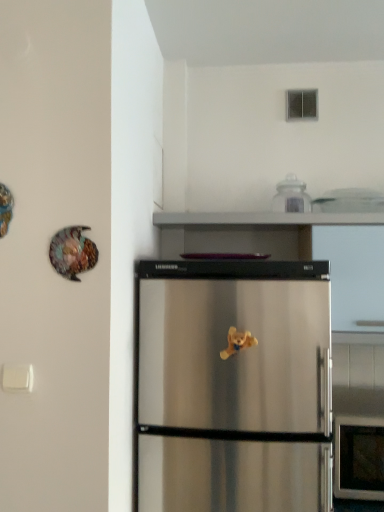
Question: Can you confirm if clear glass jar at upper center is positioned to the right of shiny metallic plate at upper left?

Choices:
 (A) yes
 (B) no

Answer: (A)

Question: Considering the relative sizes of clear glass jar at upper center and shiny metallic plate at upper left in the image provided, is clear glass jar at upper center smaller than shiny metallic plate at upper left?

Choices:
 (A) yes
 (B) no

Answer: (B)

Question: From a real-world perspective, is clear glass jar at upper center below shiny metallic plate at upper left?

Choices:
 (A) yes
 (B) no

Answer: (B)

Question: Does clear glass jar at upper center have a greater height compared to shiny metallic plate at upper left?

Choices:
 (A) no
 (B) yes

Answer: (B)

Question: Is clear glass jar at upper center not inside shiny metallic plate at upper left?

Choices:
 (A) no
 (B) yes

Answer: (B)

Question: Would you say shiny metallic plate at upper left is to the left or to the right of clear glass jar at upper center in the picture?

Choices:
 (A) right
 (B) left

Answer: (B)

Question: In terms of width, does shiny metallic plate at upper left look wider or thinner when compared to clear glass jar at upper center?

Choices:
 (A) wide
 (B) thin

Answer: (B)

Question: Looking at the image, does shiny metallic plate at upper left seem bigger or smaller compared to clear glass jar at upper center?

Choices:
 (A) big
 (B) small

Answer: (B)

Question: Is shiny metallic plate at upper left taller or shorter than clear glass jar at upper center?

Choices:
 (A) short
 (B) tall

Answer: (A)

Question: Is shiny metallic plate at upper left situated inside yellow plush bear at center or outside?

Choices:
 (A) outside
 (B) inside

Answer: (A)

Question: In terms of width, does shiny metallic plate at upper left look wider or thinner when compared to yellow plush bear at center?

Choices:
 (A) wide
 (B) thin

Answer: (B)

Question: From a real-world perspective, relative to yellow plush bear at center, is shiny metallic plate at upper left vertically above or below?

Choices:
 (A) below
 (B) above

Answer: (B)

Question: In terms of height, does shiny metallic plate at upper left look taller or shorter compared to yellow plush bear at center?

Choices:
 (A) short
 (B) tall

Answer: (B)

Question: From the image's perspective, is yellow plush bear at center positioned above or below clear glass jar at upper center?

Choices:
 (A) above
 (B) below

Answer: (B)

Question: From a real-world perspective, is yellow plush bear at center physically located above or below clear glass jar at upper center?

Choices:
 (A) below
 (B) above

Answer: (A)